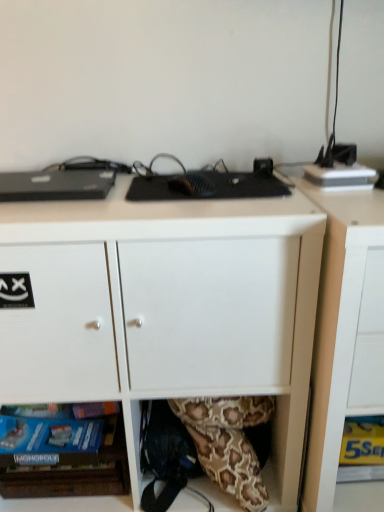
Question: From the image's perspective, is yellow paper at lower right located above or below white matte desk at center?

Choices:
 (A) below
 (B) above

Answer: (A)

Question: Looking at the image, does yellow paper at lower right seem bigger or smaller compared to white matte desk at center?

Choices:
 (A) small
 (B) big

Answer: (A)

Question: Which of these objects is positioned farthest from the wooden board games at lower left?

Choices:
 (A) matte white cabinet at lower right
 (B) yellow paper at lower right
 (C) white matte desk at center

Answer: (B)

Question: Estimate the real-world distances between objects in this image. Which object is farther from the white matte desk at center?

Choices:
 (A) wooden board games at lower left
 (B) yellow paper at lower right
 (C) matte white cabinet at lower right

Answer: (B)